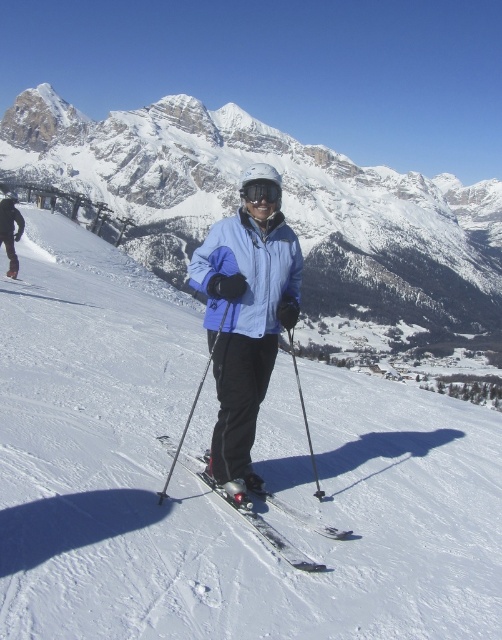
You are a drone operator trying to capture the skier on the white snow ski slope at center. Based on the coordinates provided, where should you position the drone to ensure the skier is centered in the frame?

The white snow ski slope at center is located at coordinates point [206,488], so positioning the drone directly above this point will center the skier in the frame.

You are a drone operator trying to capture a photo of the black matte jacket at center and the white snow ski slope at center from above. The drone has a camera that can focus on objects within a 50 meter radius. Will the drone be able to capture both objects in one photo?

The white snow ski slope at center and black matte jacket at center are 54.49 meters apart, which exceeds the drone camera focus range of 50 meters. Therefore, the drone cannot capture both objects in one photo.

You are a photographer trying to capture a closeup shot of the skier. You want to ensure that both the matte blue jacket at center and the black matte goggles at center are fully visible in the frame. Given their positions and sizes, is there a risk that one might be partially cut off if you focus on the center?

The matte blue jacket at center might be wider than black matte goggles at center, so there is a risk that the matte blue jacket at center could be partially cut off if the frame is centered, as it may extend beyond the edges more than the goggles.